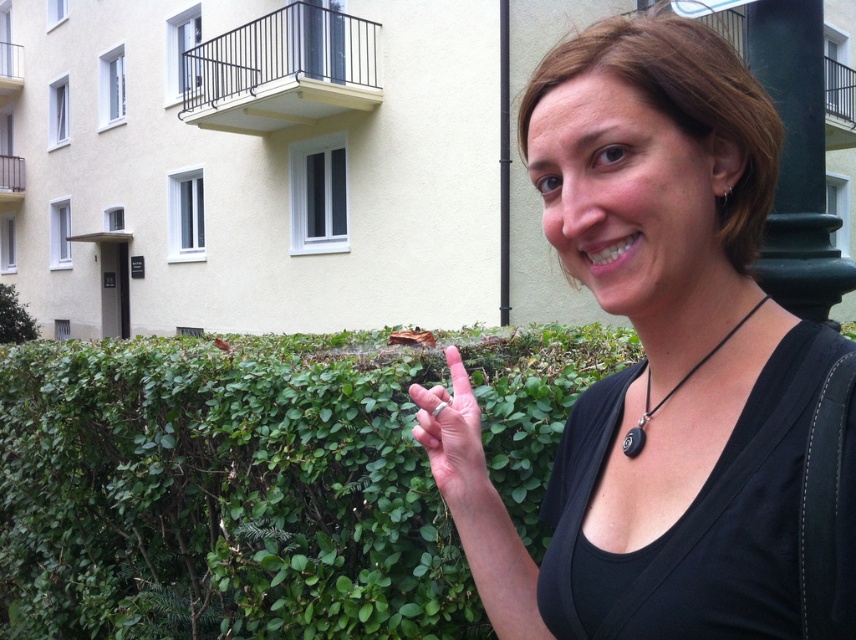
You are a photographer trying to capture the black matte pendant at lower right and the green leafy hedge at center in the same frame. Based on their positions, which object should you adjust your camera to focus on first to ensure both are in the shot?

The green leafy hedge at center is to the left of the black matte pendant at lower right. To capture both in the same frame, focus on the black matte pendant at lower right first since it is further to the right and adjust the camera angle to include the hedge on the left.

In the scene shown: You are a photographer adjusting your camera settings to focus on the black matte necklace at upper right. The camera has a focus grid with coordinates from 0 to 1. What are the coordinates where you should aim the focus point?

The black matte necklace at upper right is located at point [663,349], so you should aim the focus point at those coordinates to ensure proper focus.

Consider the image. You are planning to take a photo of the green leafy hedge at center and the silver metallic ring at center. Which object should you focus on first if you want to capture both in a single frame without moving the camera?

The green leafy hedge at center is much taller than the silver metallic ring at center, so you should focus on the green leafy hedge at center first to ensure it fits within the frame.